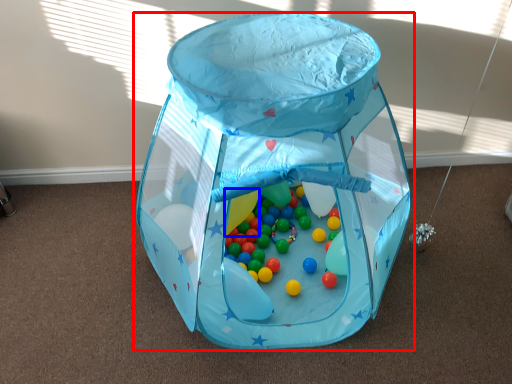
Question: Which point is closer to the camera, toy (highlighted by a red box) or balloon (highlighted by a blue box)?

Choices:
 (A) toy
 (B) balloon

Answer: (A)